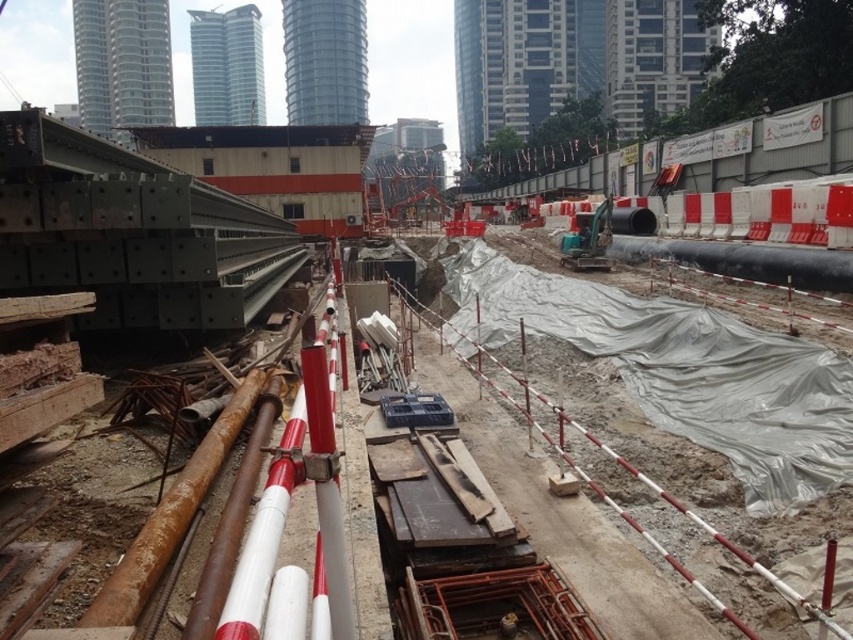
Who is shorter, gray tarpaulin at center or red fabric construction worker at center?

Standing shorter between the two is red fabric construction worker at center.

Locate an element on the screen. gray tarpaulin at center is located at coordinates (631, 477).

Image resolution: width=853 pixels, height=640 pixels. I want to click on gray tarpaulin at center, so click(631, 477).